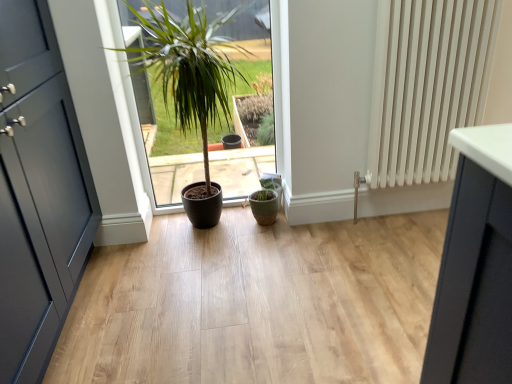
The width and height of the screenshot is (512, 384). In order to click on free location in front of matte green flowerpot at center in this screenshot , I will do `click(269, 233)`.